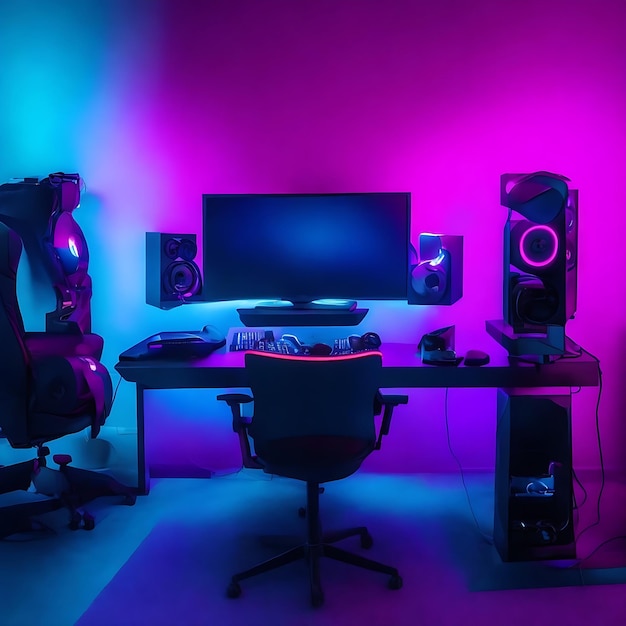
I want to click on computer monitor screen, so click(297, 257).